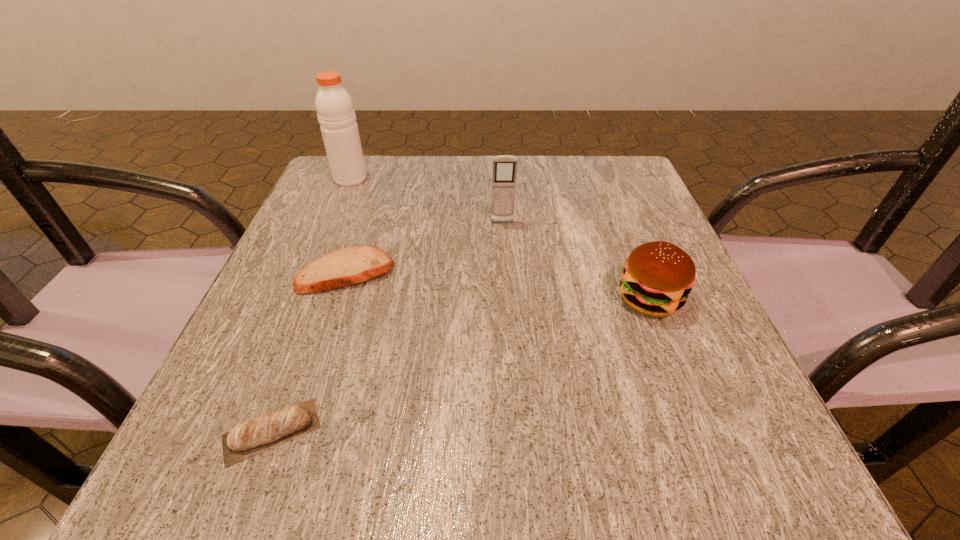
Identify the location of free space located on the back of the rightmost object. The image size is (960, 540). (597, 165).

Locate an element on the screen. The height and width of the screenshot is (540, 960). free space located on the right of the farther pita bread is located at coordinates (509, 273).

Locate an element on the screen. The width and height of the screenshot is (960, 540). vacant area situated 0.100m on the right of the nearer pita bread is located at coordinates (396, 431).

Image resolution: width=960 pixels, height=540 pixels. Find the location of `object present at the far edge`. object present at the far edge is located at coordinates (335, 110).

The width and height of the screenshot is (960, 540). In order to click on object positioned at the near edge in this screenshot , I will do `click(248, 438)`.

You are a GUI agent. You are given a task and a screenshot of the screen. Output one action in this format:
    pyautogui.click(x=<x>, y=<y>)
    Task: Click on the shaker present at the left edge
    
    Given the screenshot: What is the action you would take?
    pyautogui.click(x=335, y=110)

The image size is (960, 540). I want to click on object that is positioned at the right edge, so click(x=658, y=276).

I want to click on object that is at the far left corner, so click(x=335, y=110).

Locate an element on the screen. object at the near left corner is located at coordinates (248, 438).

At what (x,y) coordinates should I click in order to perform the action: click on vacant space at the far edge of the desktop. Please return your answer as a coordinate pair (x, y). Looking at the image, I should click on (492, 203).